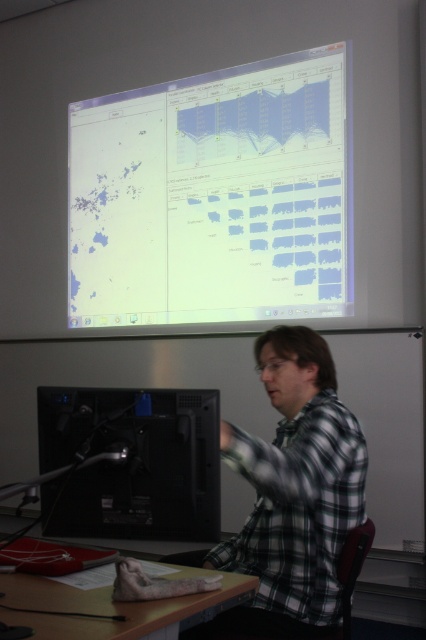
You are a student sitting in the classroom and notice a point at coordinates (213, 196) on the white glossy screen at upper center. What object is located at that point?

The point at coordinates (213, 196) corresponds to the white glossy screen at upper center.

You are a student sitting in the classroom and need to locate the black matte computer at lower left. According to the coordinates given, where exactly is it positioned in the image?

The black matte computer at lower left is positioned at the 2D coordinate point of [135,461] in the image.

You are a student sitting in the classroom and want to look at both the plaid fabric shirt at lower right and the white glossy screen at upper center. Which object should you look up towards to see?

The white glossy screen at upper center is above the plaid fabric shirt at lower right, so you should look up towards the white glossy screen at upper center to see it.